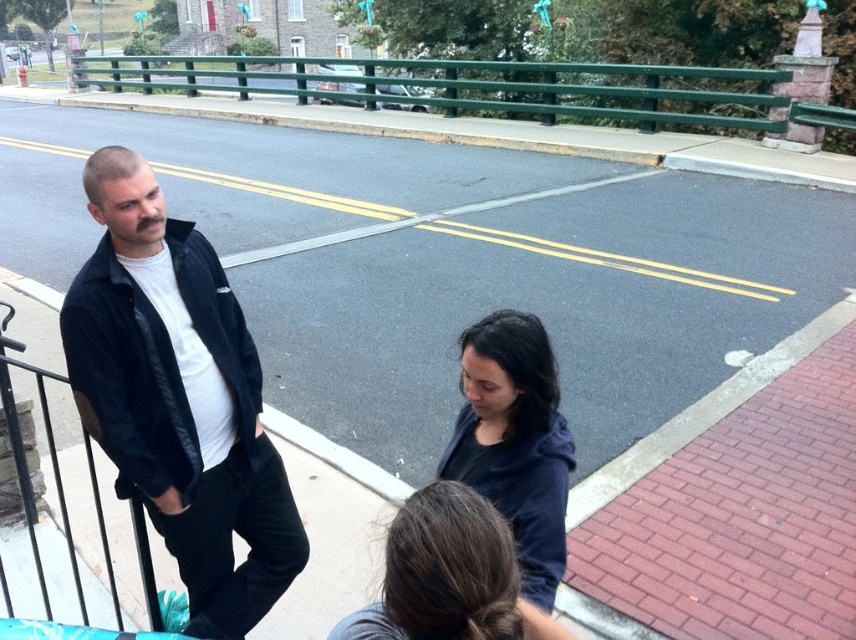
You are a delivery person with a 30 inch wide package. You need to pass between the black leather jacket at left and dark blue hoodie at center. Can you fit through the space between them?

The distance between the black leather jacket at left and dark blue hoodie at center is 31.65 inches, which is wider than your 30 inch package. Yes, you can fit through the space between them.

You are a delivery person who needs to place a 10 feet long package between the black leather jacket at left and the green painted metal railing at upper center. Can you fit it without moving either object?

The distance between the black leather jacket at left and the green painted metal railing at upper center is 41.75 feet. Since the package is only 10 feet long, it can easily fit within that space without needing to move either object.

You are a fashion designer observing the clothing items in the scene. Which clothing item, the black leather jacket at left or the dark blue hoodie at center, has a larger size?

The black leather jacket at left is bigger than the dark blue hoodie at center.